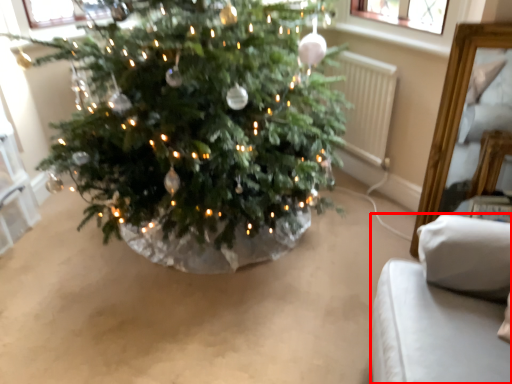
Question: Observing the image, what is the correct spatial positioning of furniture (annotated by the red box) in reference to radiator?

Choices:
 (A) right
 (B) left

Answer: (A)